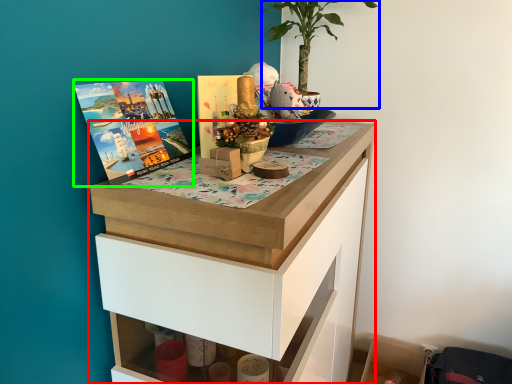
Question: Which object is the closest to the chest of drawers (highlighted by a red box)? Choose among these: houseplant (highlighted by a blue box) or book cover (highlighted by a green box).

Choices:
 (A) houseplant
 (B) book cover

Answer: (B)